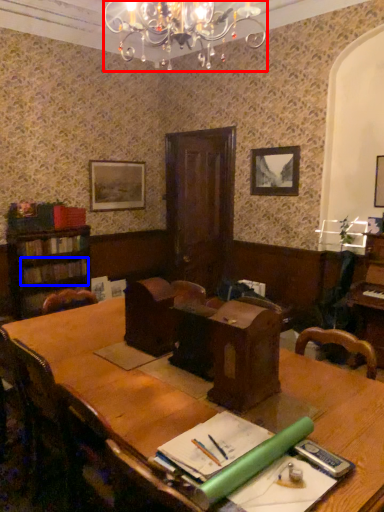
Question: Which point is closer to the camera, light fixture (highlighted by a red box) or book (highlighted by a blue box)?

Choices:
 (A) light fixture
 (B) book

Answer: (A)